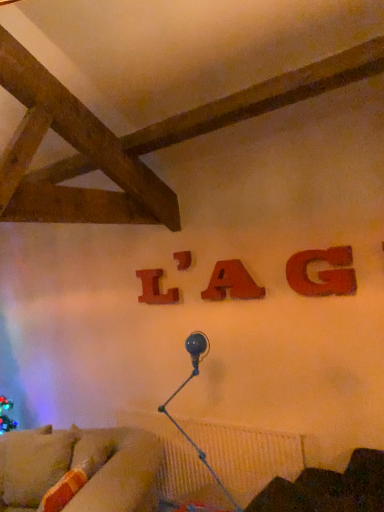
Question: Should I look upward or downward to see wooden letter a at center, which is counted as the second alphabet, starting from the front?

Choices:
 (A) up
 (B) down

Answer: (B)

Question: Is velvet dark brown armchair at lower right far from wooden letter l at center, which is the 1th alphabet in left-to-right order?

Choices:
 (A) no
 (B) yes

Answer: (B)

Question: Considering the relative sizes of velvet dark brown armchair at lower right and wooden letter l at center, positioned as the 1th alphabet in back-to-front order, in the image provided, is velvet dark brown armchair at lower right bigger than wooden letter l at center, positioned as the 1th alphabet in back-to-front order,?

Choices:
 (A) yes
 (B) no

Answer: (A)

Question: From a real-world perspective, is velvet dark brown armchair at lower right located higher than wooden letter l at center, which is the 1th alphabet in left-to-right order?

Choices:
 (A) yes
 (B) no

Answer: (B)

Question: Is velvet dark brown armchair at lower right placed right next to wooden letter l at center, which is the 1th alphabet in left-to-right order?

Choices:
 (A) yes
 (B) no

Answer: (B)

Question: From a real-world perspective, is velvet dark brown armchair at lower right under wooden letter l at center, which is the fourth alphabet from front to back?

Choices:
 (A) yes
 (B) no

Answer: (A)

Question: Is velvet dark brown armchair at lower right looking in the opposite direction of wooden letter l at center, which is the 1th alphabet in left-to-right order?

Choices:
 (A) no
 (B) yes

Answer: (A)

Question: Is matte wood letter g at upper right, positioned as the first alphabet in front-to-back order, smaller than metallic blue lamp at lower center?

Choices:
 (A) no
 (B) yes

Answer: (B)

Question: Is matte wood letter g at upper right, positioned as the first alphabet in front-to-back order, located outside metallic blue lamp at lower center?

Choices:
 (A) yes
 (B) no

Answer: (A)

Question: Is matte wood letter g at upper right, the 4th alphabet viewed from the left, facing towards metallic blue lamp at lower center?

Choices:
 (A) no
 (B) yes

Answer: (A)

Question: Is matte wood letter g at upper right, positioned as the first alphabet in front-to-back order, in contact with metallic blue lamp at lower center?

Choices:
 (A) yes
 (B) no

Answer: (B)

Question: From the image's perspective, is matte wood letter g at upper right, the fourth alphabet when ordered from back to front, on metallic blue lamp at lower center?

Choices:
 (A) yes
 (B) no

Answer: (A)

Question: Considering the relative positions of matte wood letter g at upper right, placed as the 1th alphabet when sorted from right to left, and metallic blue lamp at lower center in the image provided, is matte wood letter g at upper right, placed as the 1th alphabet when sorted from right to left, to the right of metallic blue lamp at lower center from the viewer's perspective?

Choices:
 (A) yes
 (B) no

Answer: (A)

Question: Can you confirm if matte wood letter g at upper right, positioned as the first alphabet in front-to-back order, is bigger than velvet beige couch at lower left?

Choices:
 (A) no
 (B) yes

Answer: (A)